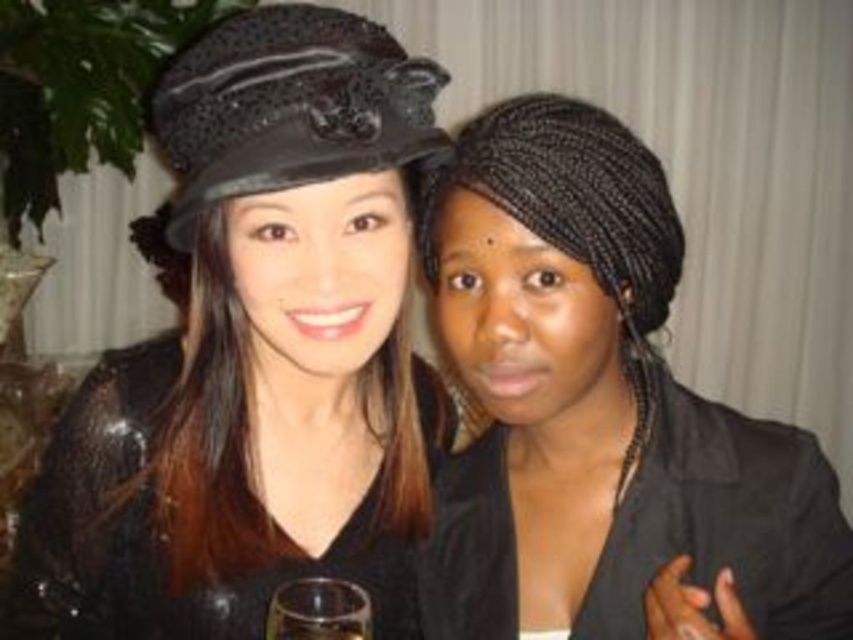
Question: Which object is closer to the camera taking this photo?

Choices:
 (A) black textured hat at upper left
 (B) black braided hair at center
 (C) transparent glass at center
 (D) matte black hat at upper left

Answer: (A)

Question: Estimate the real-world distances between objects in this image. Which object is closer to the matte black hat at upper left?

Choices:
 (A) black braided hair at center
 (B) black textured hat at upper left
 (C) transparent glass at center

Answer: (B)

Question: Does black braided hair at center have a lesser width compared to black textured hat at upper left?

Choices:
 (A) yes
 (B) no

Answer: (B)

Question: Among these points, which one is nearest to the camera?

Choices:
 (A) (325, 589)
 (B) (213, 472)
 (C) (474, 170)
 (D) (386, 156)

Answer: (D)

Question: Can you confirm if matte black hat at upper left is wider than transparent glass at center?

Choices:
 (A) no
 (B) yes

Answer: (B)

Question: Does black textured hat at upper left have a smaller size compared to transparent glass at center?

Choices:
 (A) no
 (B) yes

Answer: (A)